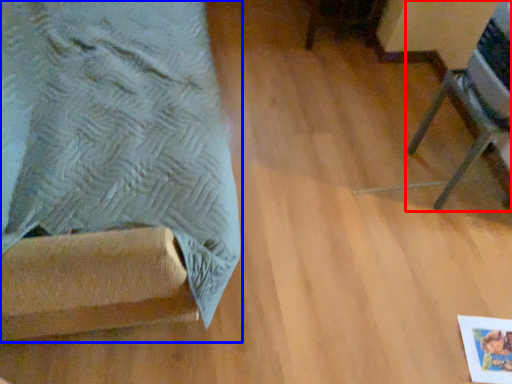
Question: Which object appears farthest to the camera in this image, furniture (highlighted by a red box) or furniture (highlighted by a blue box)?

Choices:
 (A) furniture
 (B) furniture

Answer: (A)